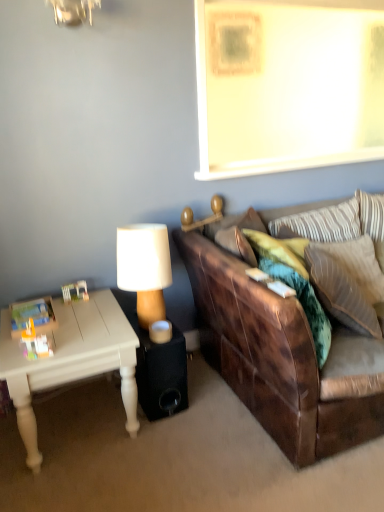
Image resolution: width=384 pixels, height=512 pixels. Find the location of `vacant space in front of white painted wood coffee table at lower left`. vacant space in front of white painted wood coffee table at lower left is located at coordinates (78, 484).